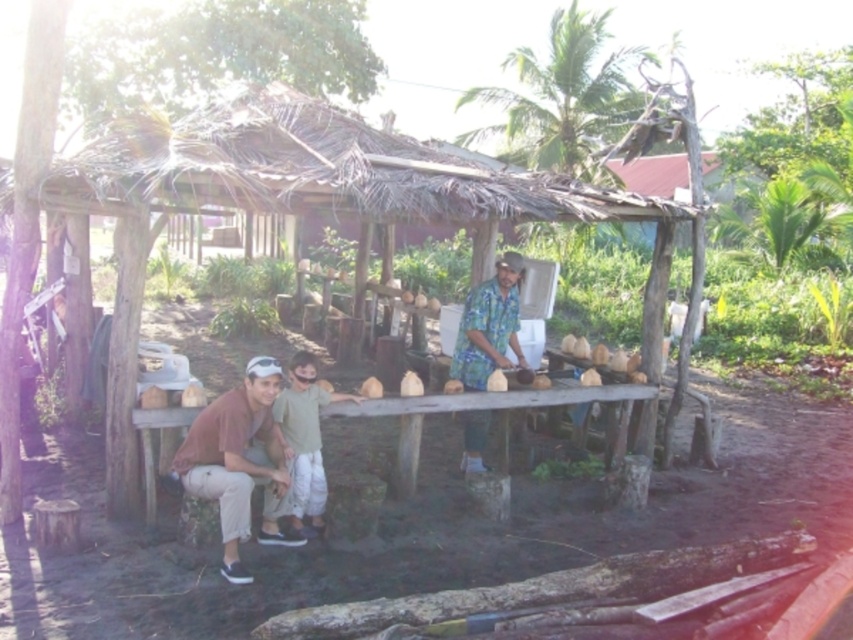
Is point (596, 387) positioned in front of point (514, 264)?

No, it is behind (514, 264).

Which is more to the right, wooden table at lower left or floral fabric shirt at center?

Positioned to the right is wooden table at lower left.

Find the location of a particular element. The image size is (853, 640). wooden table at lower left is located at coordinates (498, 417).

Does floral fabric shirt at center come behind light green cotton shirt at lower left?

That is True.

Measure the distance between point (x=486, y=358) and camera.

18.88 feet

Locate an element on the screen. floral fabric shirt at center is located at coordinates (489, 324).

Can you confirm if brown cotton shirt at lower left is positioned below floral fabric shirt at center?

Indeed, brown cotton shirt at lower left is positioned under floral fabric shirt at center.

Is brown cotton shirt at lower left wider than floral fabric shirt at center?

Yes, brown cotton shirt at lower left is wider than floral fabric shirt at center.

The width and height of the screenshot is (853, 640). I want to click on brown cotton shirt at lower left, so click(x=241, y=461).

Locate an element on the screen. The height and width of the screenshot is (640, 853). brown cotton shirt at lower left is located at coordinates (241, 461).